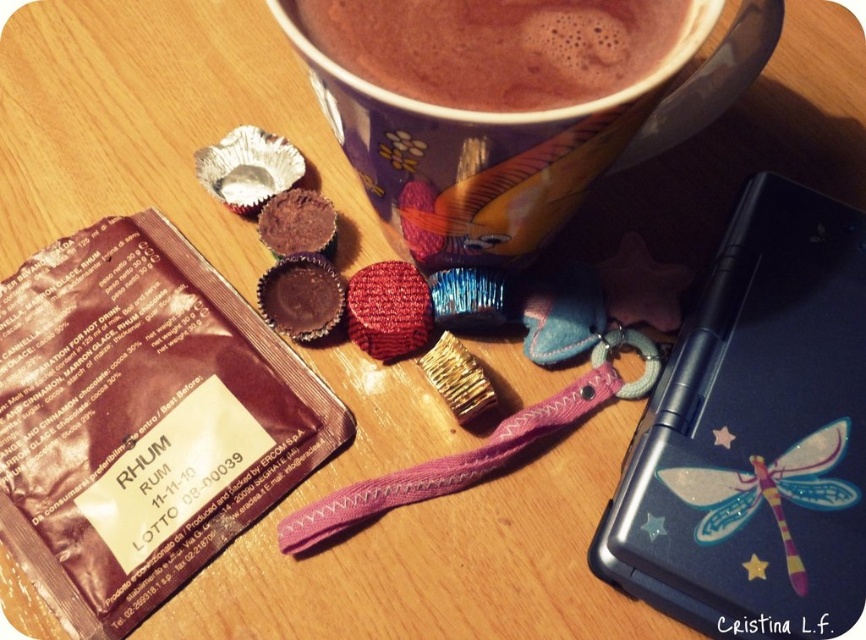
Between matte ceramic mug at upper center and brown matte cup at upper center, which one is positioned higher?

brown matte cup at upper center is higher up.

Who is shorter, matte ceramic mug at upper center or brown matte cup at upper center?

With less height is brown matte cup at upper center.

You are a GUI agent. You are given a task and a screenshot of the screen. Output one action in this format:
    pyautogui.click(x=<x>, y=<y>)
    Task: Click on the matte ceramic mug at upper center
    
    Given the screenshot: What is the action you would take?
    (x=481, y=148)

Between matte ceramic mug at upper center and translucent plastic dragonfly at upper right, which one appears on the left side from the viewer's perspective?

Positioned to the left is matte ceramic mug at upper center.

Is matte ceramic mug at upper center wider than translucent plastic dragonfly at upper right?

Indeed, matte ceramic mug at upper center has a greater width compared to translucent plastic dragonfly at upper right.

Which is in front, point (408, 182) or point (735, 502)?

Positioned in front is point (408, 182).

Image resolution: width=866 pixels, height=640 pixels. Find the location of `matte ceramic mug at upper center`. matte ceramic mug at upper center is located at coordinates (481, 148).

Which is more to the right, brown shiny chocolate bar at lower left or translucent plastic dragonfly at upper right?

translucent plastic dragonfly at upper right is more to the right.

Between point (272, 403) and point (835, 488), which one is positioned in front?

Point (835, 488) is more forward.

Find the location of a particular element. The width and height of the screenshot is (866, 640). brown shiny chocolate bar at lower left is located at coordinates (141, 419).

Locate an element on the screen. brown shiny chocolate bar at lower left is located at coordinates (141, 419).